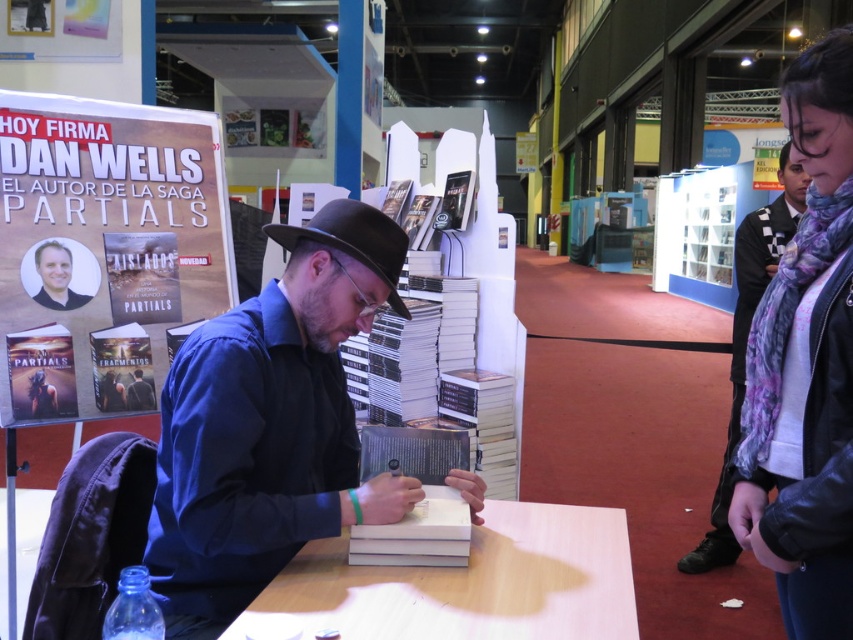
You are organizing a photo shoot for a fashion magazine and need to place a mannequin holding the purple scarf at right and the smooth skin portrait at center. Based on the scene description, which object should be placed farther from the camera to maintain their relative sizes as seen in the original image?

The purple scarf at right should be placed farther from the camera because its width is larger than the smooth skin portrait at center, so to maintain the same relative sizes, the wider object needs to be positioned farther away.

You are standing at the book signing event and want to take a photo of the two points marked in the image. Which point, point (817, 93) or point (83, 300), is closer to you?

Point (817, 93) is closer to the viewer than point (83, 300).

You are an event organizer checking the setup for a book signing. You notice the black matte shirt at center and the white paper at center. Which item is covering the other?

The black matte shirt at center is positioned over white paper at center, so it is covering the white paper at center.